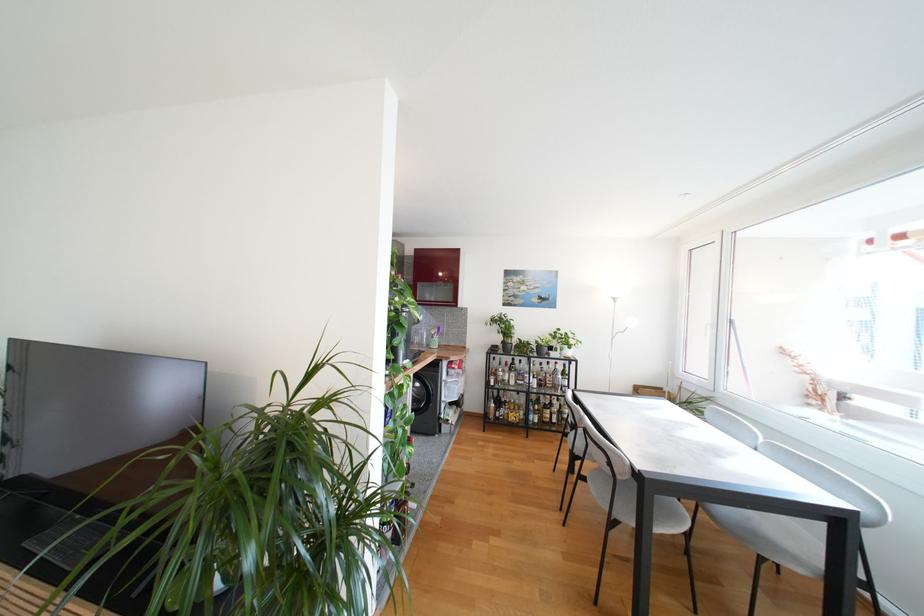
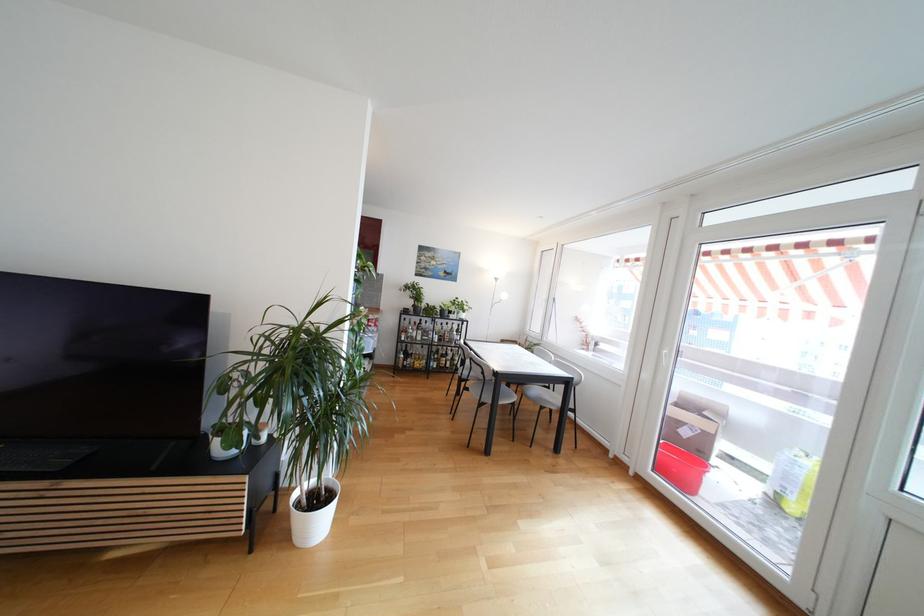
Locate, in the second image, the point that corresponds to pixel 555 389 in the first image.

(453, 342)